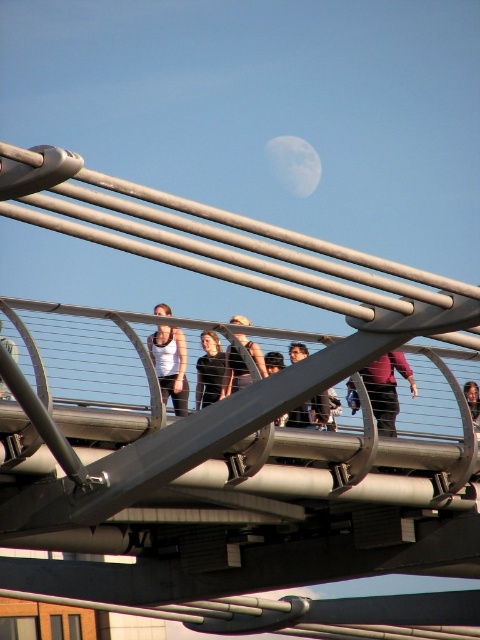
Question: Among these objects, which one is farthest from the camera?

Choices:
 (A) matte black tank top at center
 (B) matte black jacket at center
 (C) silver metallic moon at upper center
 (D) dark gray shirt at center

Answer: (C)

Question: Can you confirm if white matte tank top at center is wider than matte black jacket at center?

Choices:
 (A) no
 (B) yes

Answer: (B)

Question: Which point is farther to the camera?

Choices:
 (A) pos(158,342)
 (B) pos(278,141)

Answer: (B)

Question: Is white matte tank top at center positioned at the back of matte black tank top at center?

Choices:
 (A) no
 (B) yes

Answer: (B)

Question: Does white matte tank top at center come behind dark gray fabric jacket at center?

Choices:
 (A) no
 (B) yes

Answer: (A)

Question: Among these points, which one is farthest from the camera?

Choices:
 (A) (255, 348)
 (B) (295, 140)
 (C) (3, 342)

Answer: (B)